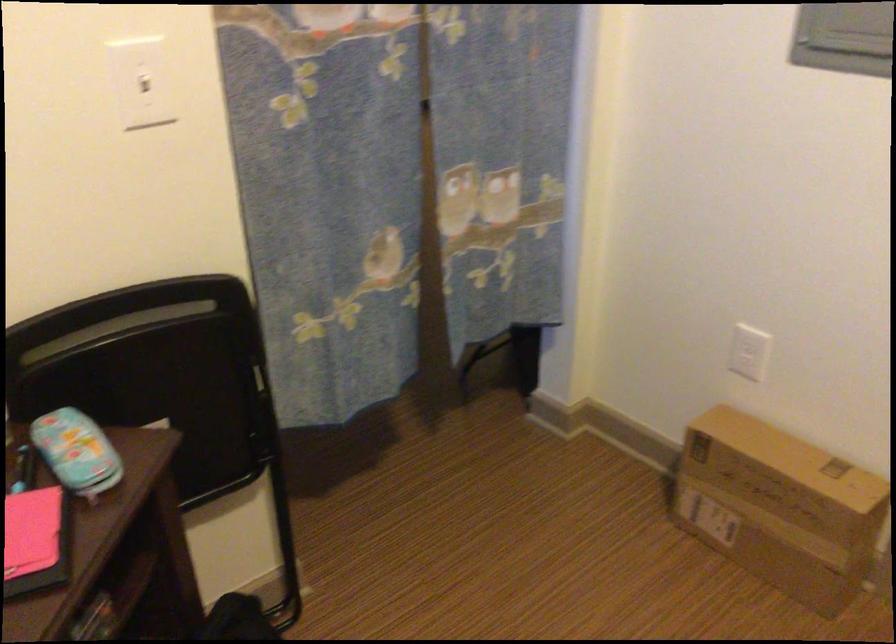
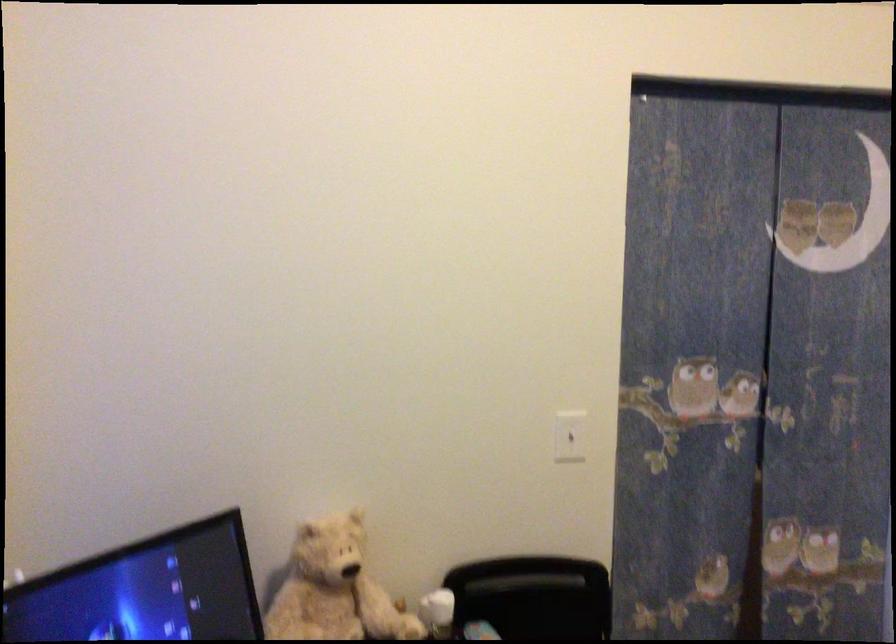
In the second image, find the point that corresponds to (x=149, y=87) in the first image.

(570, 436)